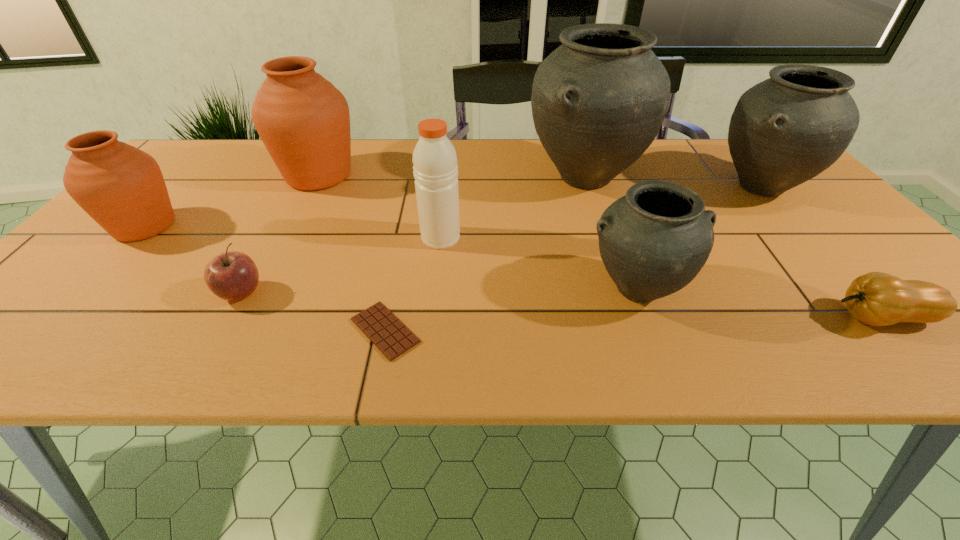
You are a GUI agent. You are given a task and a screenshot of the screen. Output one action in this format:
    pyautogui.click(x=<x>, y=<y>)
    Task: Click on the gourd that is at the right edge
    The image size is (960, 540).
    Given the screenshot: What is the action you would take?
    pyautogui.click(x=878, y=299)

You are a GUI agent. You are given a task and a screenshot of the screen. Output one action in this format:
    pyautogui.click(x=<x>, y=<y>)
    Task: Click on the object at the far right corner
    This screenshot has width=960, height=540.
    Given the screenshot: What is the action you would take?
    pyautogui.click(x=785, y=130)

Locate an element on the screen. Image resolution: width=960 pixels, height=540 pixels. object that is at the near right corner is located at coordinates (878, 299).

The height and width of the screenshot is (540, 960). Identify the location of free space at the far edge. (711, 171).

Locate an element on the screen. Image resolution: width=960 pixels, height=540 pixels. vacant area at the near edge is located at coordinates (250, 330).

Find the location of a particular element. This screenshot has height=540, width=960. vacant region at the far left corner of the desktop is located at coordinates (204, 154).

Image resolution: width=960 pixels, height=540 pixels. Identify the location of free area in between the brown candy bar and the nearest urn. (511, 310).

Locate an element on the screen. unoccupied position between the bigger brown urn and the rightmost black urn is located at coordinates (540, 181).

The width and height of the screenshot is (960, 540). I want to click on vacant space that's between the smallest black urn and the shortest object, so click(511, 310).

Identify the location of free spot between the apple and the tallest object. This screenshot has height=540, width=960. (413, 235).